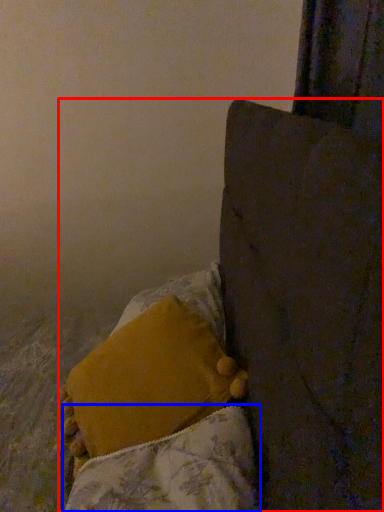
Question: Which object is closer to the camera taking this photo, furniture (highlighted by a red box) or blanket (highlighted by a blue box)?

Choices:
 (A) furniture
 (B) blanket

Answer: (A)